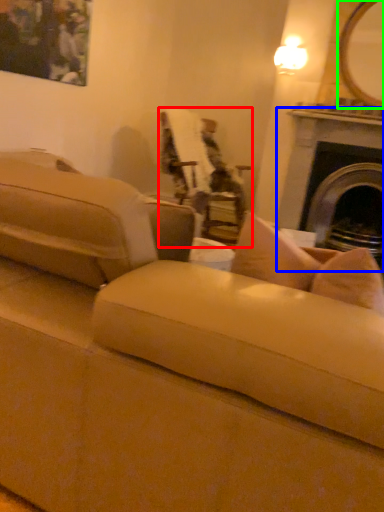
Question: Which is nearer to the chair (highlighted by a red box)? fireplace (highlighted by a blue box) or mirror (highlighted by a green box).

Choices:
 (A) fireplace
 (B) mirror

Answer: (A)